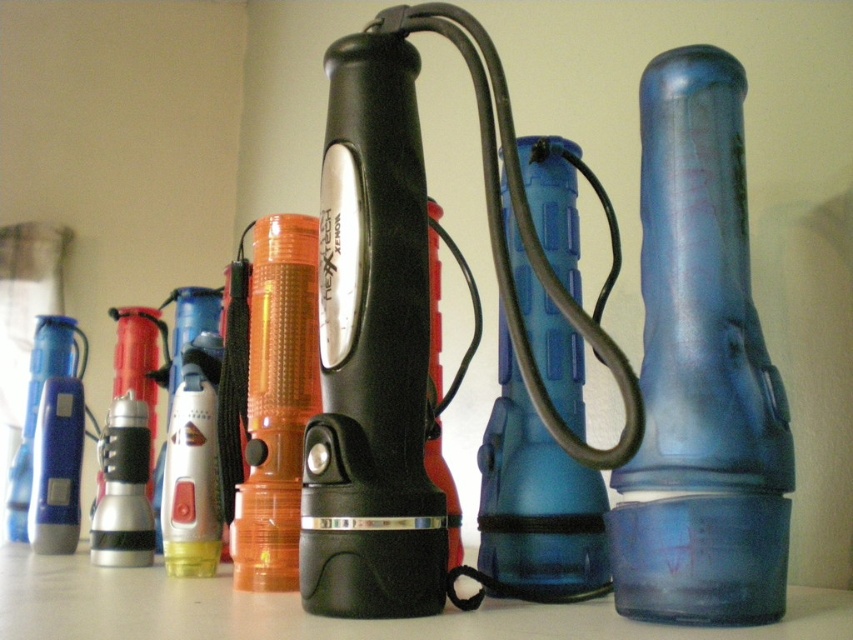
Does transparent blue flashlight at right appear under blue translucent bottle at center?

No.

Which is behind, point (660, 140) or point (16, 506)?

The point (16, 506) is behind.

This screenshot has width=853, height=640. I want to click on transparent blue flashlight at right, so click(x=700, y=371).